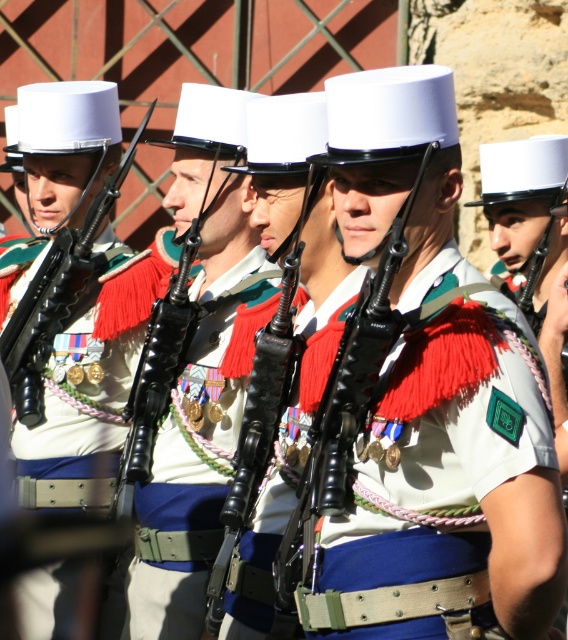
Question: Can you confirm if matte white uniform at center is smaller than shiny black rifle at center?

Choices:
 (A) no
 (B) yes

Answer: (A)

Question: Which point is closer to the camera?

Choices:
 (A) (41, 256)
 (B) (194, 504)

Answer: (B)

Question: Which object is farther from the camera taking this photo?

Choices:
 (A) white matte uniform at center
 (B) matte white uniform at center

Answer: (B)

Question: Can you confirm if white matte uniform at center is smaller than shiny black rifle at center?

Choices:
 (A) no
 (B) yes

Answer: (A)

Question: Does white matte uniform at center appear under shiny black rifle at center?

Choices:
 (A) no
 (B) yes

Answer: (A)

Question: Which object is farther from the camera taking this photo?

Choices:
 (A) matte white uniform at center
 (B) shiny black rifle at center
 (C) white matte uniform at center

Answer: (A)